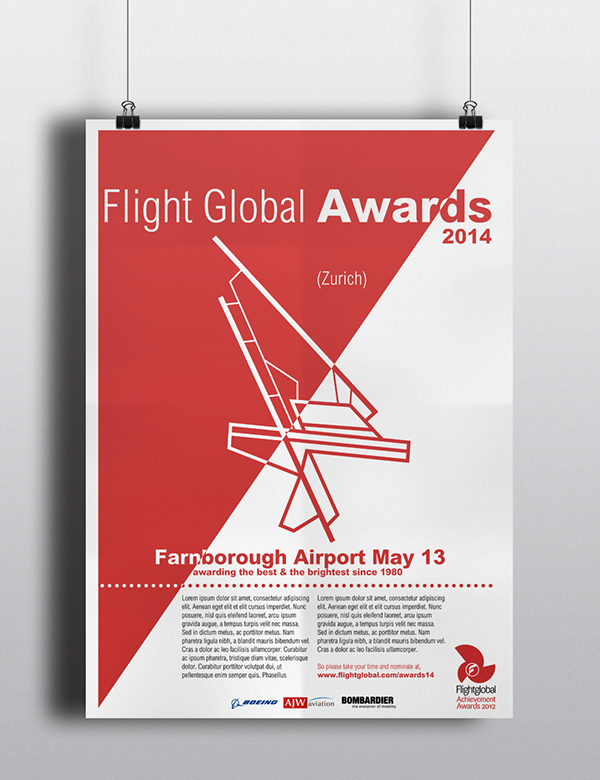
The height and width of the screenshot is (780, 600). I want to click on black binder clips, so click(124, 122), click(470, 122).